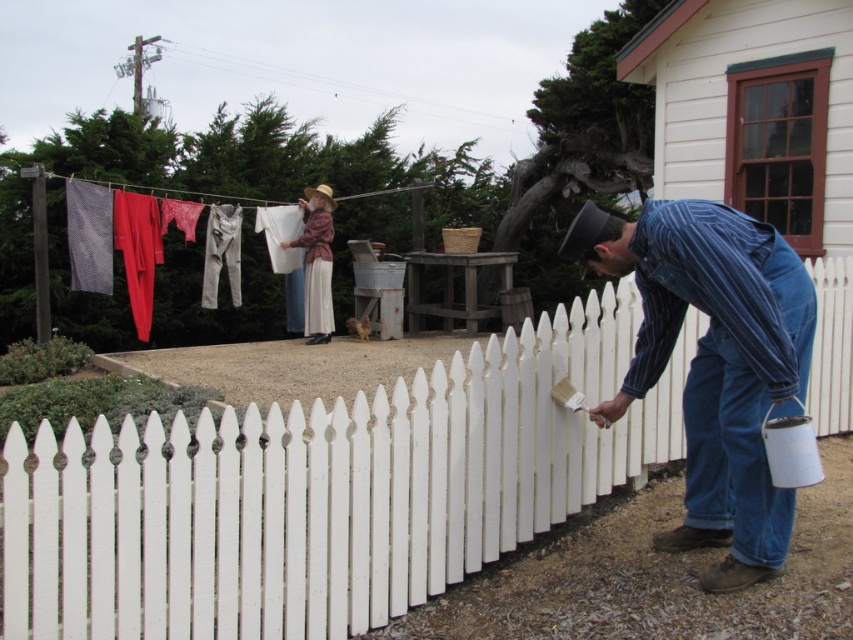
Question: Is white wooden picket fence at center wider than blue striped shirt at right?

Choices:
 (A) no
 (B) yes

Answer: (B)

Question: Which of these objects is positioned farthest from the blue striped shirt at right?

Choices:
 (A) white wooden picket fence at center
 (B) matte white fabric at upper center

Answer: (B)

Question: Which point is farther from the camera taking this photo?

Choices:
 (A) (726, 545)
 (B) (320, 317)
 (C) (262, 449)

Answer: (B)

Question: Considering the relative positions of blue striped shirt at right and matte white fabric at upper center in the image provided, where is blue striped shirt at right located with respect to matte white fabric at upper center?

Choices:
 (A) right
 (B) left

Answer: (A)

Question: Can you confirm if white wooden picket fence at center is positioned below blue striped shirt at right?

Choices:
 (A) yes
 (B) no

Answer: (A)

Question: Which object is the farthest from the white wooden picket fence at center?

Choices:
 (A) matte white fabric at upper center
 (B) blue striped shirt at right

Answer: (A)